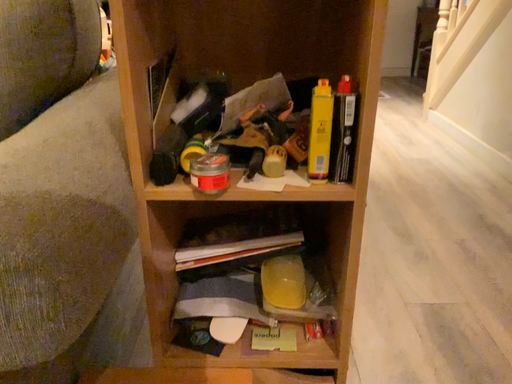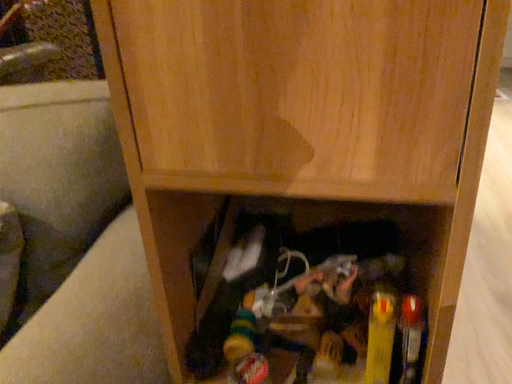
Question: Which way did the camera rotate in the video?

Choices:
 (A) rotated left
 (B) rotated right

Answer: (A)